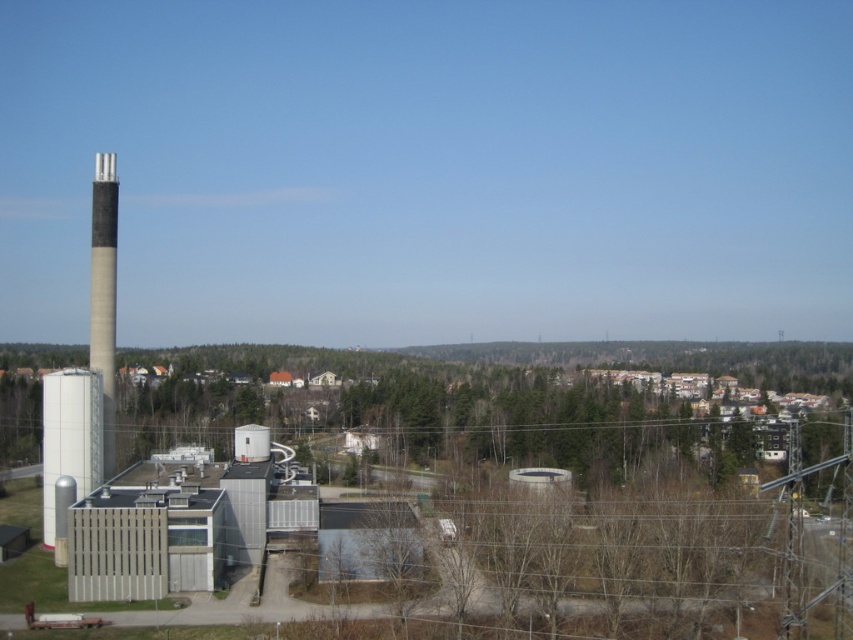
You are a delivery drone flying over the industrial area. You need to drop off a package at the silver metallic building at center. Which direction should you fly from the smooth concrete chimney at left to reach it?

The silver metallic building at center is to the right of the smooth concrete chimney at left, so you should fly to the right direction from the smooth concrete chimney at left to reach it.

You are a drone operator trying to capture aerial footage of the industrial area. You notice the white matte water tower at lower left and the smooth concrete chimney at left. Which object will appear closer to the camera in your footage?

The white matte water tower at lower left is in front of the smooth concrete chimney at left, so it will appear closer to the camera in the footage.

You are standing at a viewpoint overlooking the industrial and residential area. There is a point marked at coordinates point (x=256, y=472). If you want to place a 1.5 meter wide bench here, will there be enough space around the point?

The point (x=256, y=472) is 139.04 meters from the viewer, so there is sufficient space to place a 1.5 meter wide bench around it.